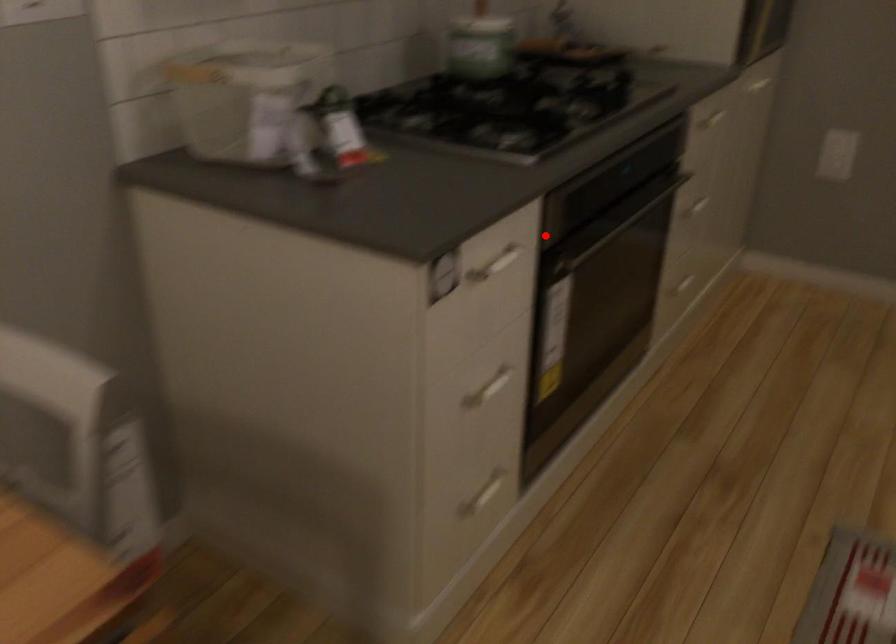
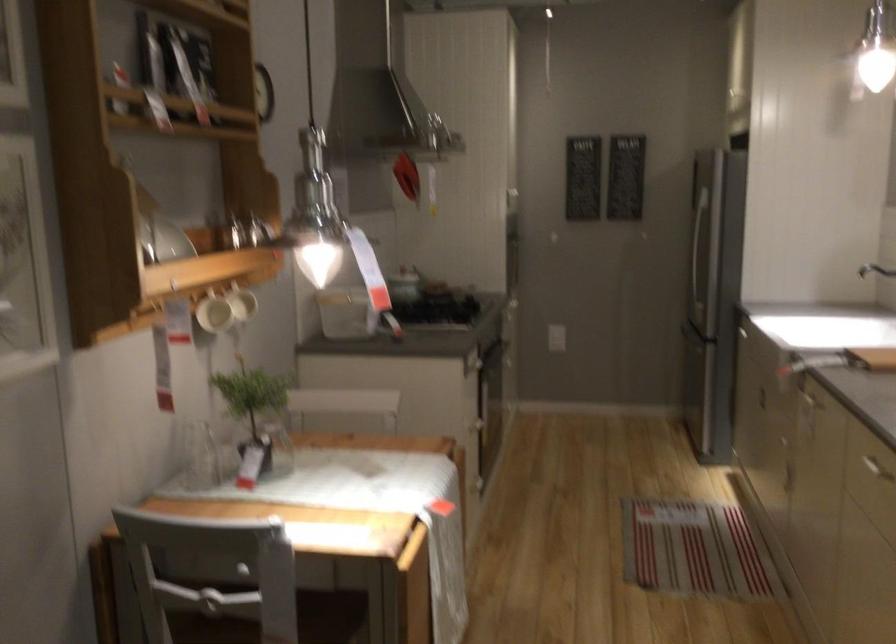
Question: I am providing you with two images of the same scene from different viewpoints. A red point is marked on the first image. Is the red point's position out of view in image 2?

Choices:
 (A) Yes
 (B) No

Answer: (B)